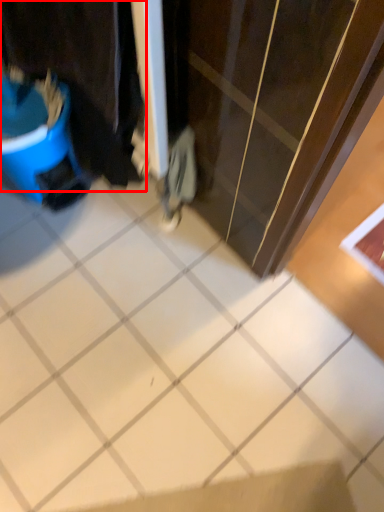
Question: From the image's perspective, what is the correct spatial relationship of laundry (annotated by the red box) in relation to ceramic tile?

Choices:
 (A) below
 (B) above

Answer: (B)